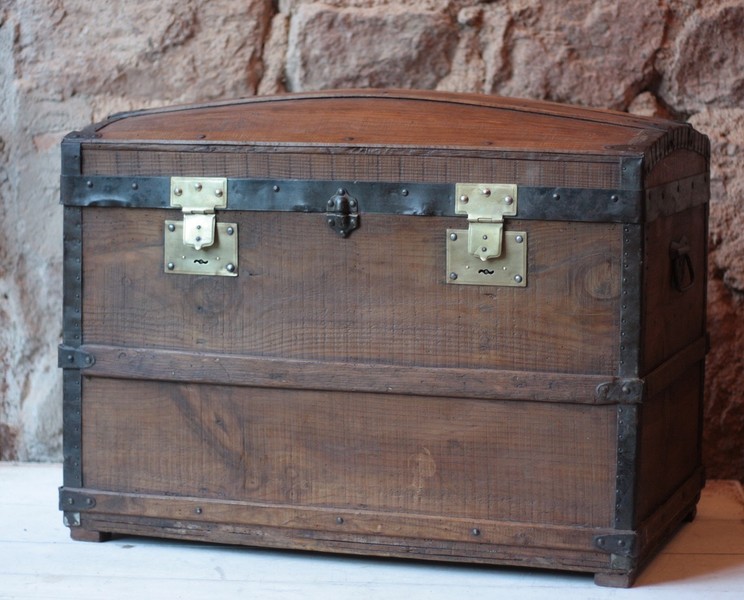
I want to click on wooden chest, so click(x=341, y=301).